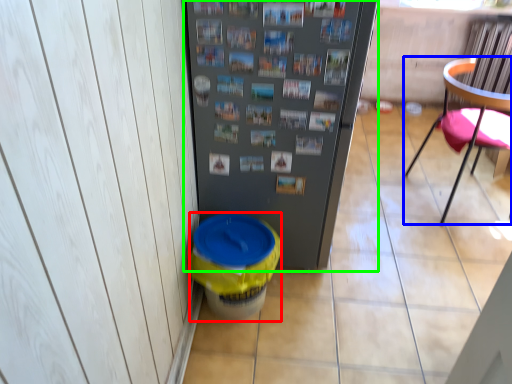
Question: Based on their relative distances, which object is nearer to potty (highlighted by a red box)? Choose from chair (highlighted by a blue box) and refrigerator (highlighted by a green box).

Choices:
 (A) chair
 (B) refrigerator

Answer: (B)